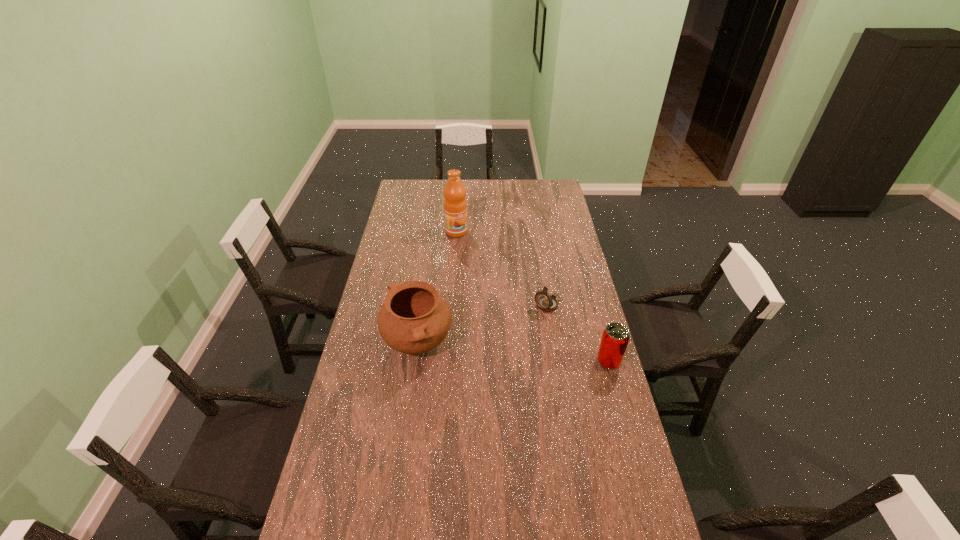
Find the location of a particular element. vacant space in between the compass and the tallest object is located at coordinates (502, 268).

Where is `free spot between the farthest object and the third shortest object`? The image size is (960, 540). free spot between the farthest object and the third shortest object is located at coordinates (437, 288).

Identify the location of object that ranks as the third closest to the fruit juice. pyautogui.click(x=615, y=338).

Where is `the closest object to the third object from left to right`? This screenshot has height=540, width=960. the closest object to the third object from left to right is located at coordinates (615, 338).

Locate an element on the screen. This screenshot has width=960, height=540. vacant space that satisfies the following two spatial constraints: 1. on the front side of the farthest object; 2. on the left side of the rightmost object is located at coordinates (447, 361).

Where is `vacant space that satisfies the following two spatial constraints: 1. on the back side of the shortest object; 2. on the right side of the pottery`? vacant space that satisfies the following two spatial constraints: 1. on the back side of the shortest object; 2. on the right side of the pottery is located at coordinates (423, 305).